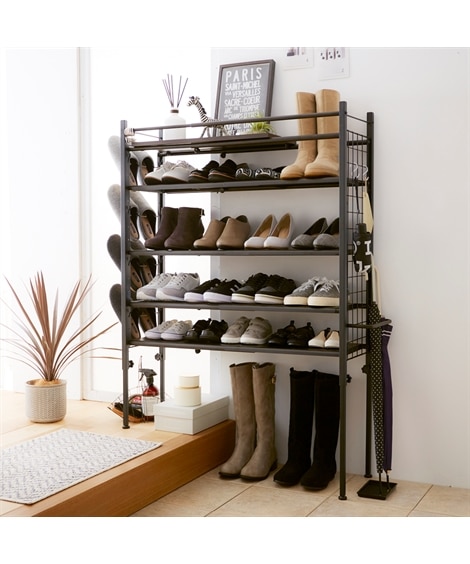
Find the location of a particular element. This screenshot has height=564, width=470. slippers is located at coordinates (129, 160), (144, 160), (129, 208), (146, 208), (129, 277), (151, 271), (133, 319), (148, 320).